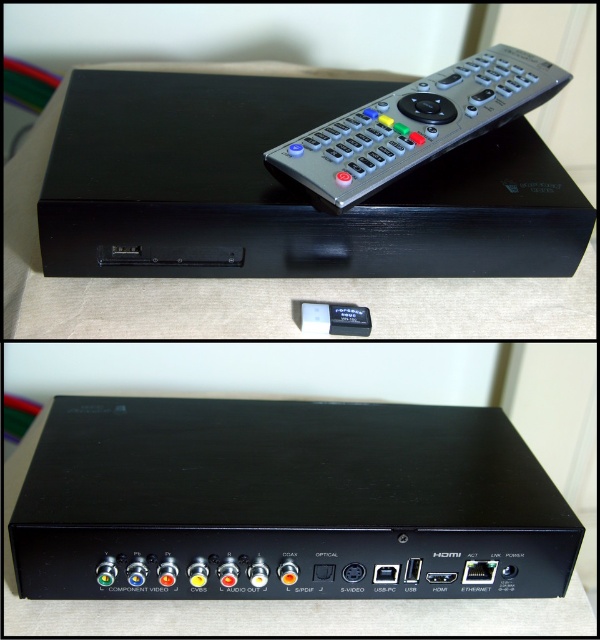
You are setting up a media player and need to place the remote control on top of the device. Based on the image, can you confirm if the silver metallic remote at upper center is positioned above the black plastic device at center?

Yes, the silver metallic remote at upper center is positioned above the black plastic device at center according to the image description.